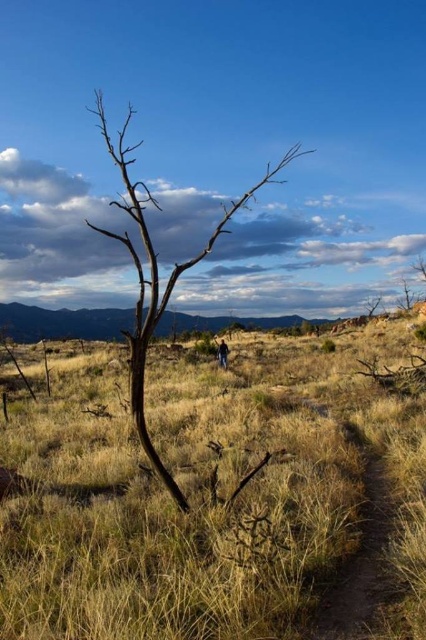
Is brown matte tree at center to the right of brown dirt path at lower right from the viewer's perspective?

Incorrect, brown matte tree at center is not on the right side of brown dirt path at lower right.

What are the coordinates of `brown matte tree at center` in the screenshot? It's located at (158, 276).

Where is `brown matte tree at center`? brown matte tree at center is located at coordinates (158, 276).

Does brown dry grass at center have a greater height compared to brown matte tree at center?

No, brown dry grass at center is not taller than brown matte tree at center.

Describe the element at coordinates (219, 493) in the screenshot. The image size is (426, 640). I see `brown dry grass at center` at that location.

I want to click on brown dry grass at center, so click(x=219, y=493).

Image resolution: width=426 pixels, height=640 pixels. Describe the element at coordinates (219, 493) in the screenshot. I see `brown dry grass at center` at that location.

Between brown dry grass at center and brown dirt path at lower right, which one is positioned lower?

brown dirt path at lower right is below.

Is point (63, 625) behind point (363, 556)?

No.

The height and width of the screenshot is (640, 426). I want to click on brown dry grass at center, so click(x=219, y=493).